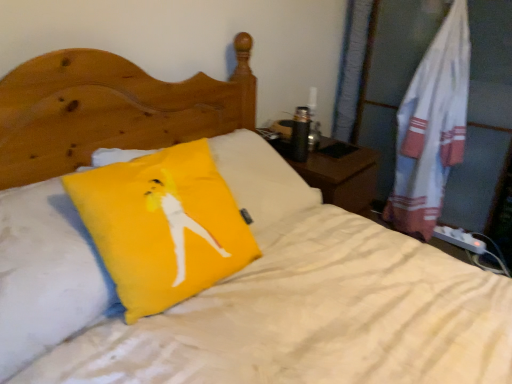
Question: Which direction should I rotate to look at yellow fabric pillow at center, which is the first pillow in left-to-right order, — up or down?

Choices:
 (A) down
 (B) up

Answer: (A)

Question: From a real-world perspective, is yellow fabric pillow at center, placed as the second pillow when sorted from right to left, positioned under yellow fabric pillow at center, acting as the 2th pillow starting from the left, based on gravity?

Choices:
 (A) no
 (B) yes

Answer: (B)

Question: From the image's perspective, is yellow fabric pillow at center, placed as the second pillow when sorted from right to left, beneath yellow fabric pillow at center, acting as the 2th pillow starting from the left?

Choices:
 (A) no
 (B) yes

Answer: (B)

Question: Can you confirm if yellow fabric pillow at center, which is the first pillow in left-to-right order, is positioned to the left of yellow fabric pillow at center, arranged as the 1th pillow when viewed from the right?

Choices:
 (A) no
 (B) yes

Answer: (B)

Question: Does yellow fabric pillow at center, which is the first pillow in left-to-right order, come in front of yellow fabric pillow at center, acting as the 2th pillow starting from the left?

Choices:
 (A) yes
 (B) no

Answer: (A)

Question: Does yellow fabric pillow at center, which is the first pillow in left-to-right order, turn towards yellow fabric pillow at center, acting as the 2th pillow starting from the left?

Choices:
 (A) no
 (B) yes

Answer: (B)

Question: Is yellow fabric pillow at center, which is the first pillow in left-to-right order, to the right of yellow fabric pillow at center, arranged as the 1th pillow when viewed from the right, from the viewer's perspective?

Choices:
 (A) no
 (B) yes

Answer: (A)

Question: Is white cotton towel at right oriented towards yellow fabric pillow at center, arranged as the 1th pillow when viewed from the right?

Choices:
 (A) no
 (B) yes

Answer: (B)

Question: Is white cotton towel at right positioned with its back to yellow fabric pillow at center, arranged as the 1th pillow when viewed from the right?

Choices:
 (A) no
 (B) yes

Answer: (A)

Question: Does white cotton towel at right have a lesser width compared to yellow fabric pillow at center, acting as the 2th pillow starting from the left?

Choices:
 (A) no
 (B) yes

Answer: (A)

Question: Is white cotton towel at right with yellow fabric pillow at center, acting as the 2th pillow starting from the left?

Choices:
 (A) no
 (B) yes

Answer: (A)

Question: Is the position of white cotton towel at right more distant than that of yellow fabric pillow at center, arranged as the 1th pillow when viewed from the right?

Choices:
 (A) yes
 (B) no

Answer: (A)

Question: From the image's perspective, is white cotton towel at right above yellow fabric pillow at center, acting as the 2th pillow starting from the left?

Choices:
 (A) yes
 (B) no

Answer: (A)

Question: From a real-world perspective, is yellow fabric pillow at center, arranged as the 1th pillow when viewed from the right, under yellow fabric pillow at center, placed as the second pillow when sorted from right to left?

Choices:
 (A) no
 (B) yes

Answer: (A)